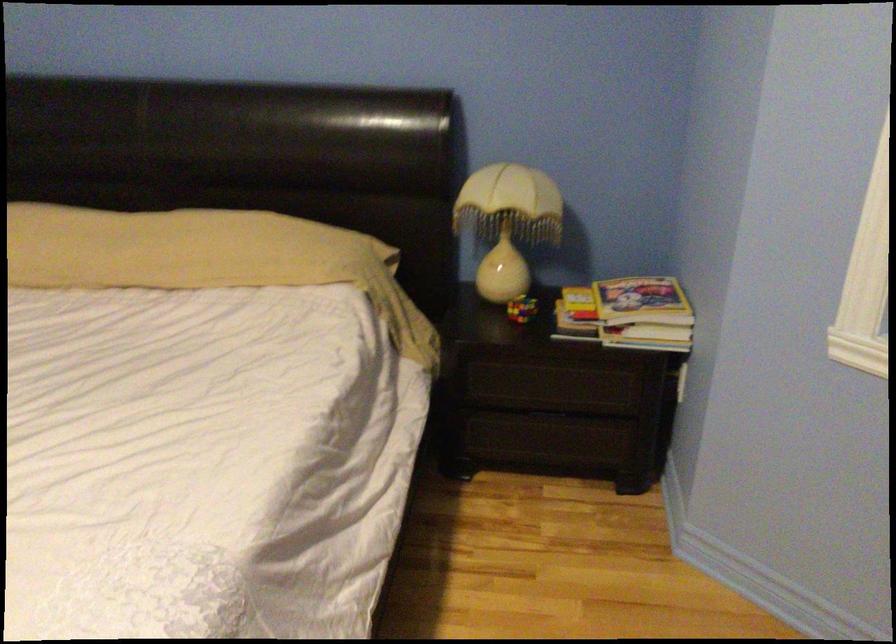
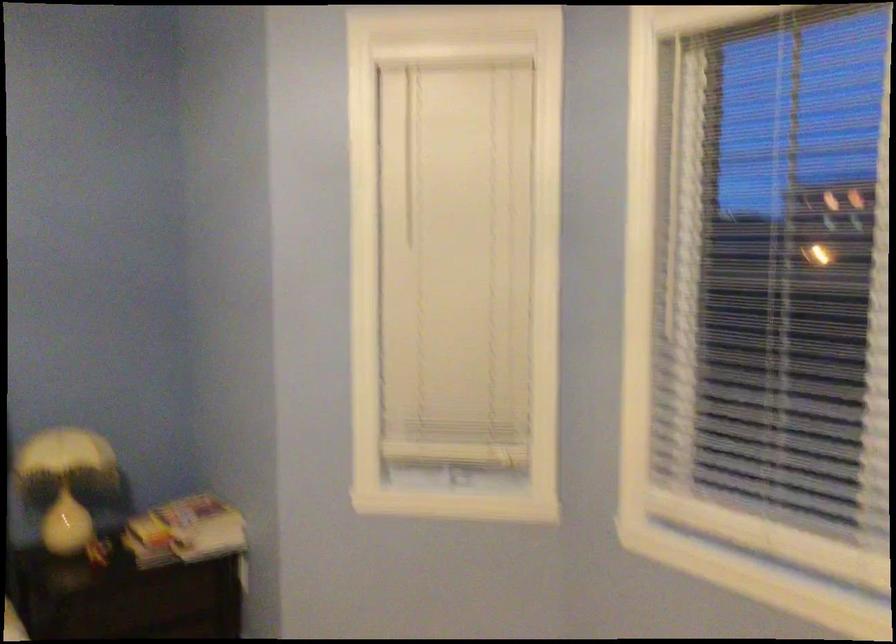
Question: I am providing you with two images of the same scene from different viewpoints. After the viewpoint changes to image2, which objects are now occluded?

Choices:
 (A) stack of magazines
 (B) blind bottom handle
 (C) blind pull cord
 (D) none of these

Answer: (D)